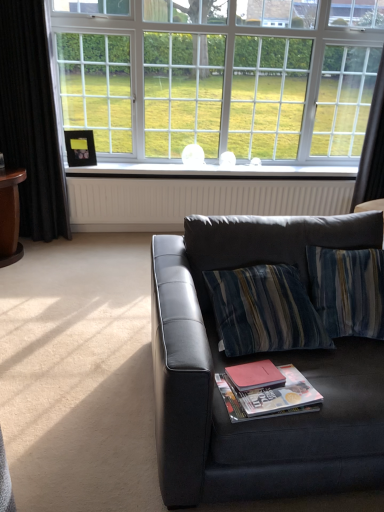
Question: Considering the positions of black matte picture frame at upper left and black velvet curtain at left, the first curtain in the left-to-right sequence, in the image, is black matte picture frame at upper left bigger or smaller than black velvet curtain at left, the first curtain in the left-to-right sequence,?

Choices:
 (A) big
 (B) small

Answer: (B)

Question: Would you say black matte picture frame at upper left is to the left or to the right of black velvet curtain at left, acting as the second curtain starting from the right, in the picture?

Choices:
 (A) right
 (B) left

Answer: (A)

Question: Which is nearer to the black matte picture frame at upper left?

Choices:
 (A) white glass window at upper center
 (B) matte black couch at center
 (C) matte paper magazine at lower center
 (D) matte red paperback book at center
 (E) dark grey fabric curtain at right, which is the 2th curtain in left-to-right order

Answer: (A)

Question: Estimate the real-world distances between objects in this image. Which object is closer to the dark grey fabric curtain at right, the first curtain in the right-to-left sequence?

Choices:
 (A) matte red paperback book at center
 (B) black velvet curtain at left, acting as the second curtain starting from the right
 (C) matte black couch at center
 (D) matte paper magazine at lower center
 (E) white glossy window sill at center

Answer: (E)